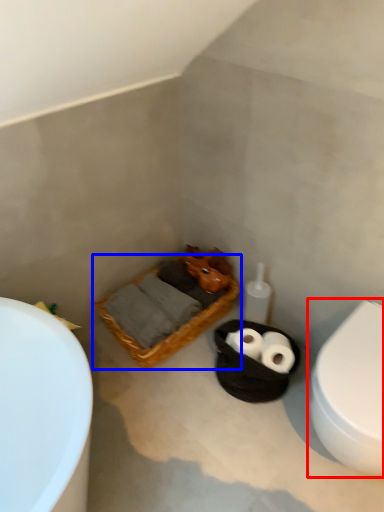
Question: Which of the following is the farthest to the observer, toilet (highlighted by a red box) or basket (highlighted by a blue box)?

Choices:
 (A) toilet
 (B) basket

Answer: (B)